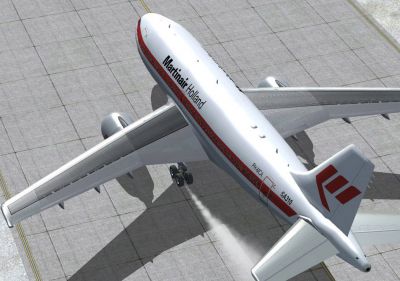
The height and width of the screenshot is (281, 400). I want to click on door, so click(x=263, y=188).